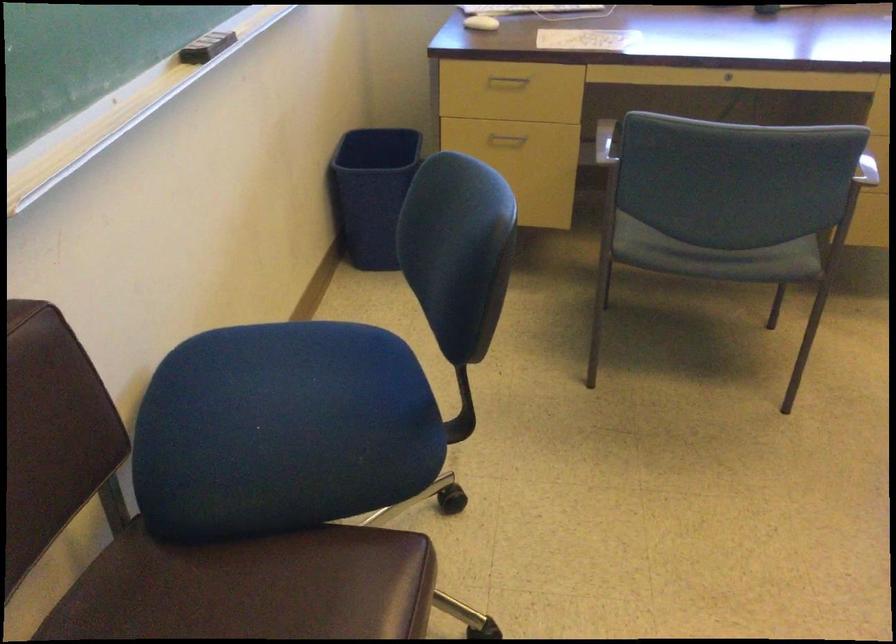
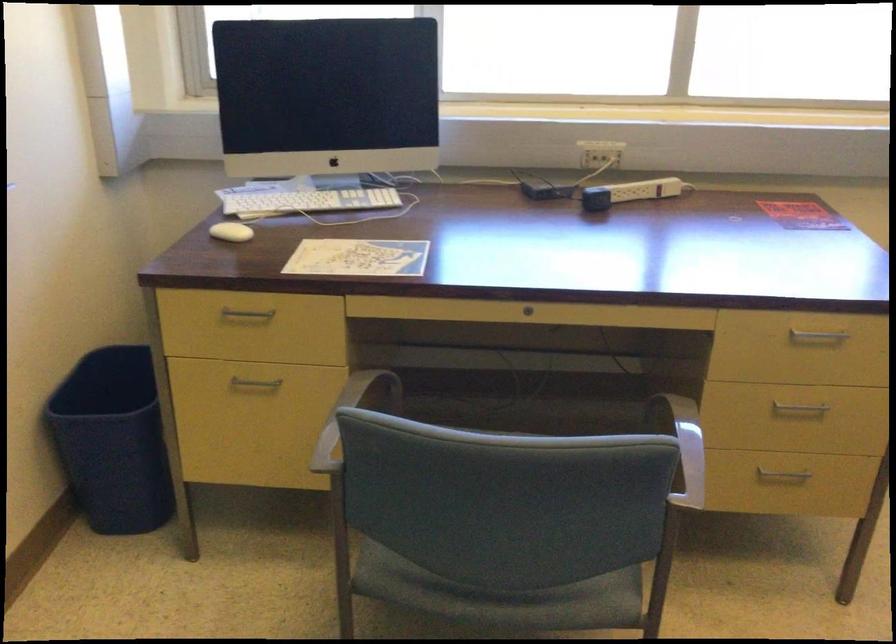
Find the pixel in the second image that matches (503,136) in the first image.

(254, 384)